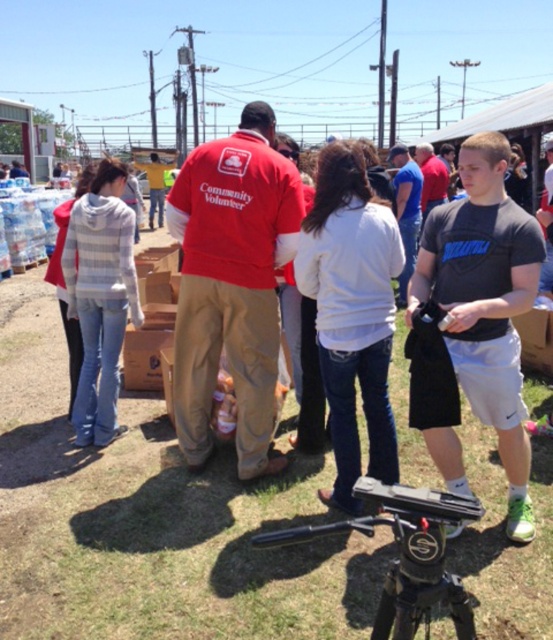
You are standing at point (369, 499) and want to take a photo of the camera mounted on the tripod. Can you reach the camera from your current position without moving? Explain why or why not.

The distance between point (369, 499) and the camera is 1.42 meters. Since you are at point (369, 499), you are 1.42 meters away from the camera. You cannot physically reach the camera from that distance without moving closer.